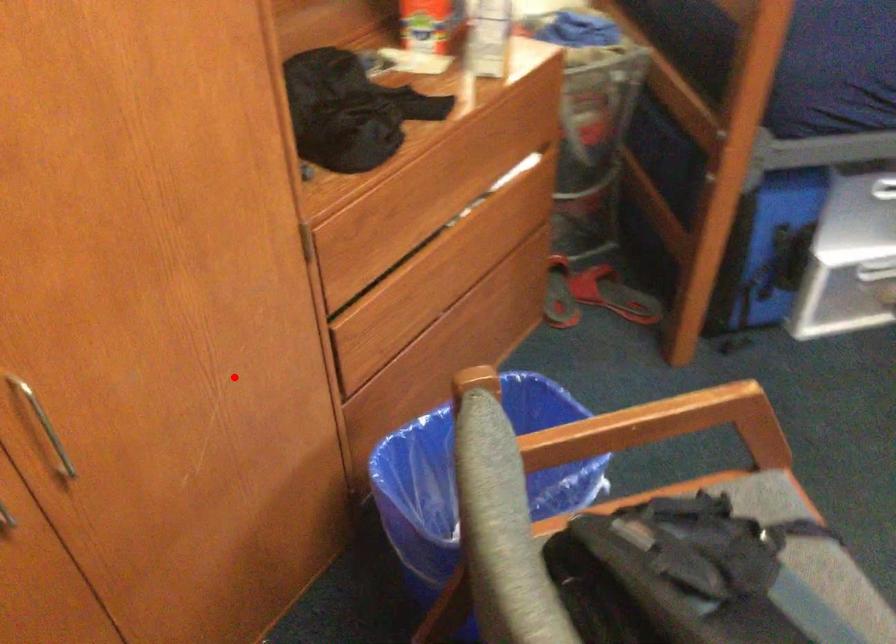
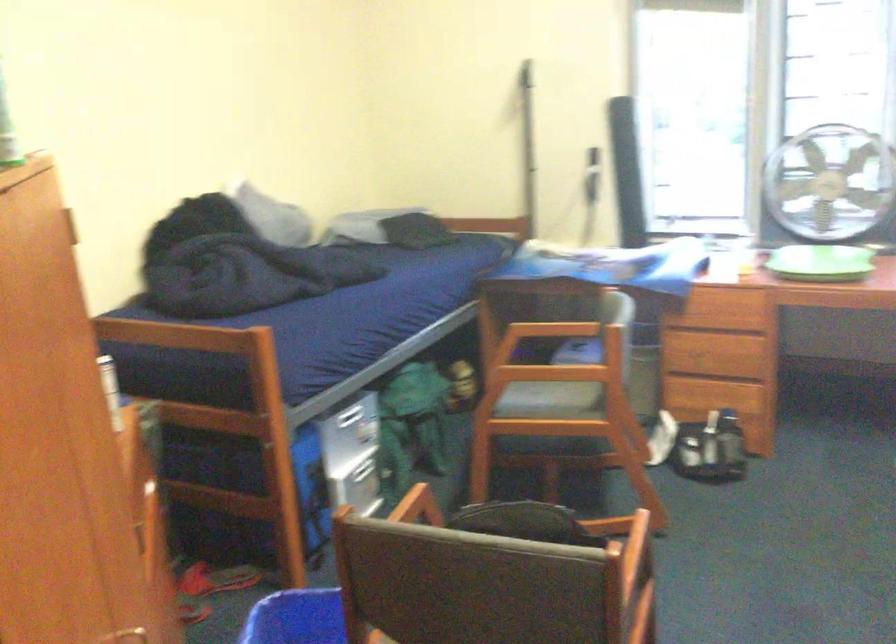
Question: I am providing you with two images of the same scene from different viewpoints. In image1, a red point is highlighted. Considering the same 3D point in image2, which of the following is correct?

Choices:
 (A) It is closer
 (B) It is farther

Answer: (B)